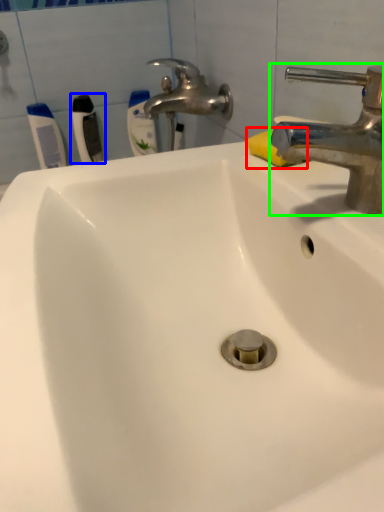
Question: Estimate the real-world distances between objects in this image. Which object is closer to soap (highlighted by a red box), toothbrush (highlighted by a blue box) or tap (highlighted by a green box)?

Choices:
 (A) toothbrush
 (B) tap

Answer: (B)